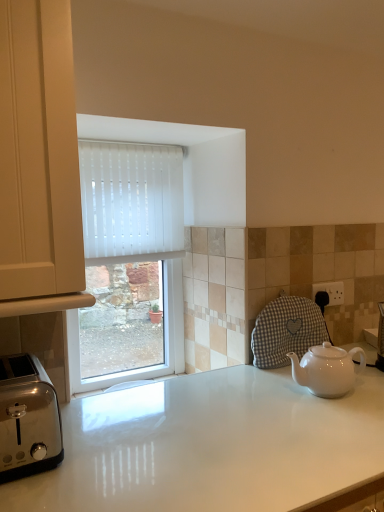
You are a GUI agent. You are given a task and a screenshot of the screen. Output one action in this format:
    pyautogui.click(x=<x>, y=<y>)
    Task: Click on the vacant location below polished stainless steel toaster at lower left (from a real-world perspective)
    
    Given the screenshot: What is the action you would take?
    pyautogui.click(x=21, y=458)